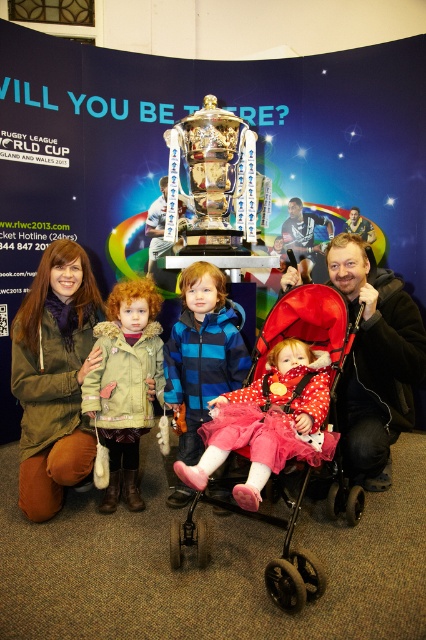
Can you confirm if gold shiny trophy at center is thinner than red fabric baby carriage at center?

Correct, gold shiny trophy at center's width is less than red fabric baby carriage at center's.

Between gold shiny trophy at center and red fabric baby carriage at center, which one is positioned lower?

red fabric baby carriage at center is lower down.

What do you see at coordinates (213, 179) in the screenshot?
I see `gold shiny trophy at center` at bounding box center [213, 179].

At what (x,y) coordinates should I click in order to perform the action: click on gold shiny trophy at center. Please return your answer as a coordinate pair (x, y). The height and width of the screenshot is (640, 426). Looking at the image, I should click on (213, 179).

Between green fuzzy coat at center and gold shiny trophy at center, which one appears on the right side from the viewer's perspective?

gold shiny trophy at center is more to the right.

Can you confirm if green fuzzy coat at center is positioned above gold shiny trophy at center?

Incorrect, green fuzzy coat at center is not positioned above gold shiny trophy at center.

Is point (131, 452) farther from camera compared to point (221, 182)?

That is False.

You are a GUI agent. You are given a task and a screenshot of the screen. Output one action in this format:
    pyautogui.click(x=<x>, y=<y>)
    Task: Click on the green fuzzy coat at center
    This screenshot has width=426, height=640.
    Given the screenshot: What is the action you would take?
    pyautogui.click(x=126, y=384)

Is point (316, 422) closer to viewer compared to point (264, 339)?

Yes, it is in front of point (264, 339).

Based on the photo, can you confirm if polka dot fabric dress at center is taller than red fabric baby carriage at center?

No.

Who is more forward, [261,444] or [314,593]?

Point [314,593]

You are a GUI agent. You are given a task and a screenshot of the screen. Output one action in this format:
    pyautogui.click(x=<x>, y=<y>)
    Task: Click on the polka dot fabric dress at center
    The height and width of the screenshot is (640, 426).
    Given the screenshot: What is the action you would take?
    pyautogui.click(x=264, y=420)